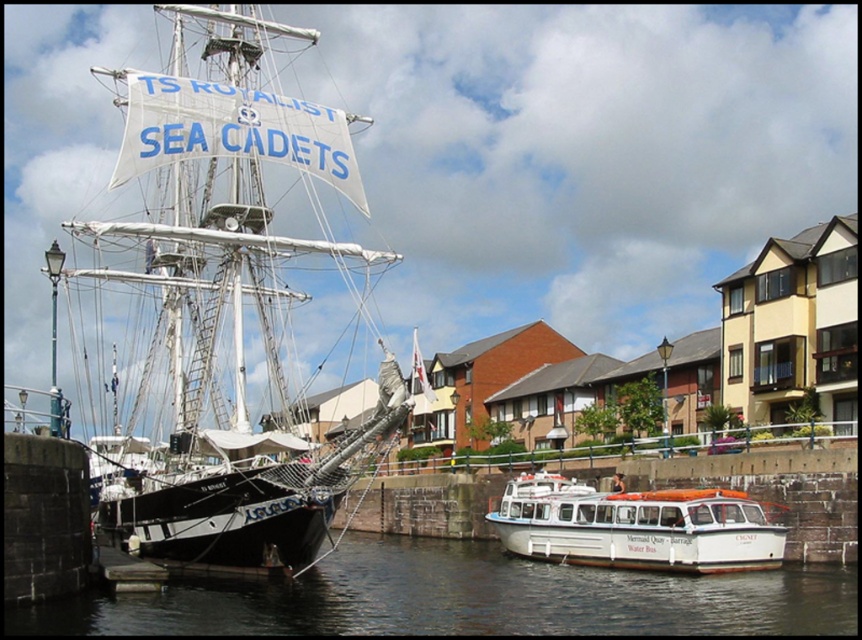
Question: In this image, where is white canvas sailboat at left located relative to white plastic boat at lower right?

Choices:
 (A) above
 (B) below

Answer: (A)

Question: Which object appears closest to the camera in this image?

Choices:
 (A) white canvas sailboat at left
 (B) white plastic boat at lower right
 (C) transparent water at lower center

Answer: (C)

Question: Which of these objects is positioned closest to the white plastic boat at lower right?

Choices:
 (A) white canvas sailboat at left
 (B) transparent water at lower center

Answer: (B)

Question: Can you confirm if white canvas sailboat at left is positioned below white plastic boat at lower right?

Choices:
 (A) yes
 (B) no

Answer: (B)

Question: Does white canvas sailboat at left come behind white plastic boat at lower right?

Choices:
 (A) no
 (B) yes

Answer: (A)

Question: Among these objects, which one is nearest to the camera?

Choices:
 (A) white canvas sailboat at left
 (B) transparent water at lower center
 (C) white plastic boat at lower right

Answer: (B)